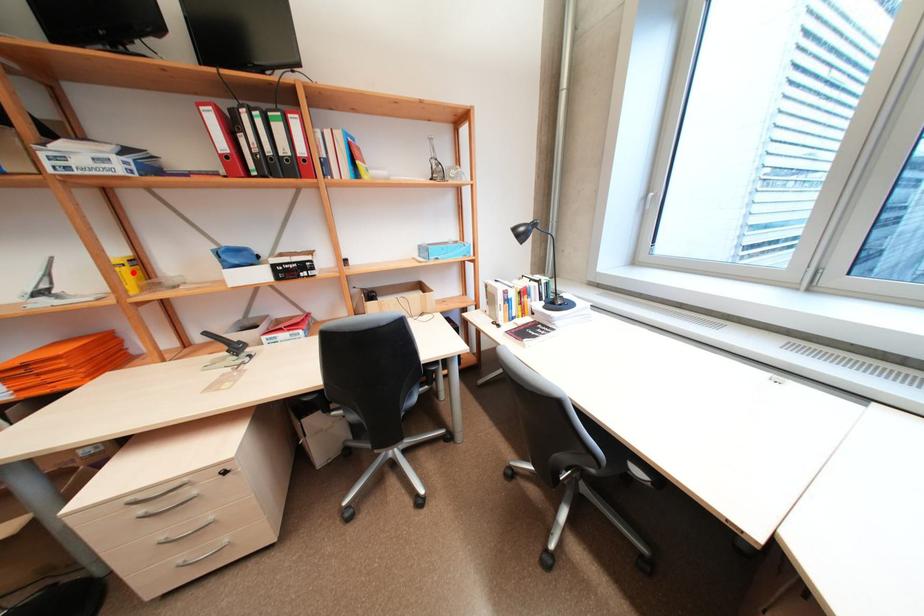
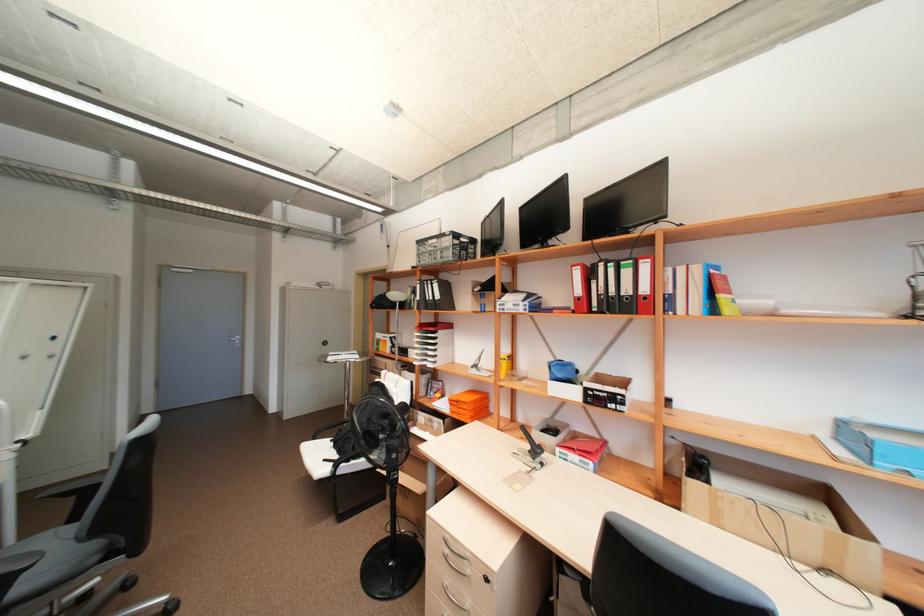
The point at the highlighted location is marked in the first image. Where is the corresponding point in the second image?

(511, 363)